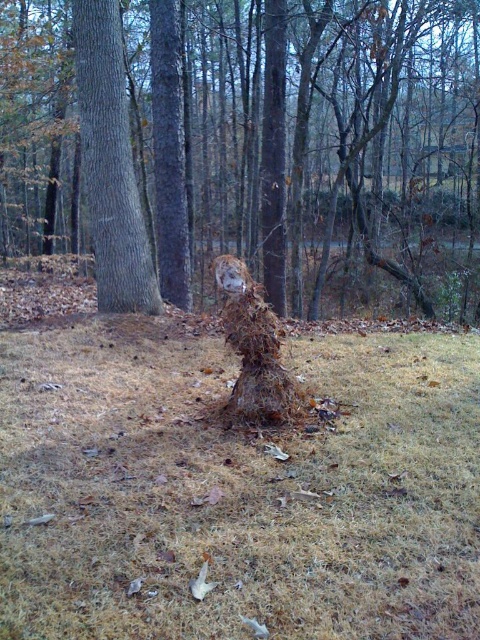
Question: Does brown rough tree trunk at left appear over brown textured stump at center?

Choices:
 (A) no
 (B) yes

Answer: (B)

Question: Can you confirm if brown rough tree trunk at left is thinner than brown textured stump at center?

Choices:
 (A) yes
 (B) no

Answer: (B)

Question: Can you confirm if brown dry grass at center is thinner than brown textured stump at center?

Choices:
 (A) no
 (B) yes

Answer: (A)

Question: Among these objects, which one is farthest from the camera?

Choices:
 (A) brown rough tree trunk at left
 (B) brown textured tree stump at center

Answer: (B)

Question: Which of these objects is positioned farthest from the brown rough tree trunk at left?

Choices:
 (A) brown textured tree stump at center
 (B) brown dry grass at center

Answer: (A)

Question: Estimate the real-world distances between objects in this image. Which object is closer to the brown textured tree stump at center?

Choices:
 (A) brown dry grass at center
 (B) brown textured stump at center
 (C) brown rough tree trunk at left

Answer: (C)